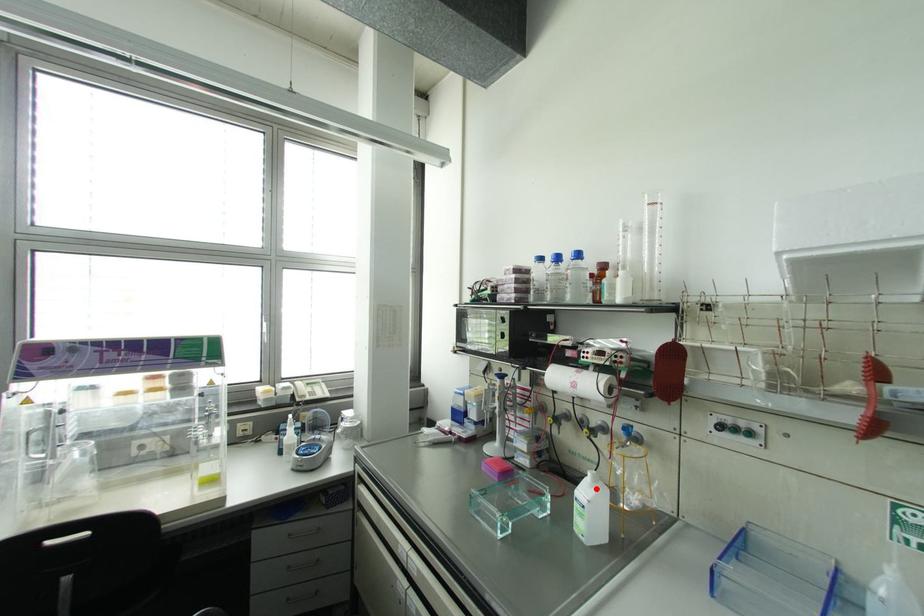
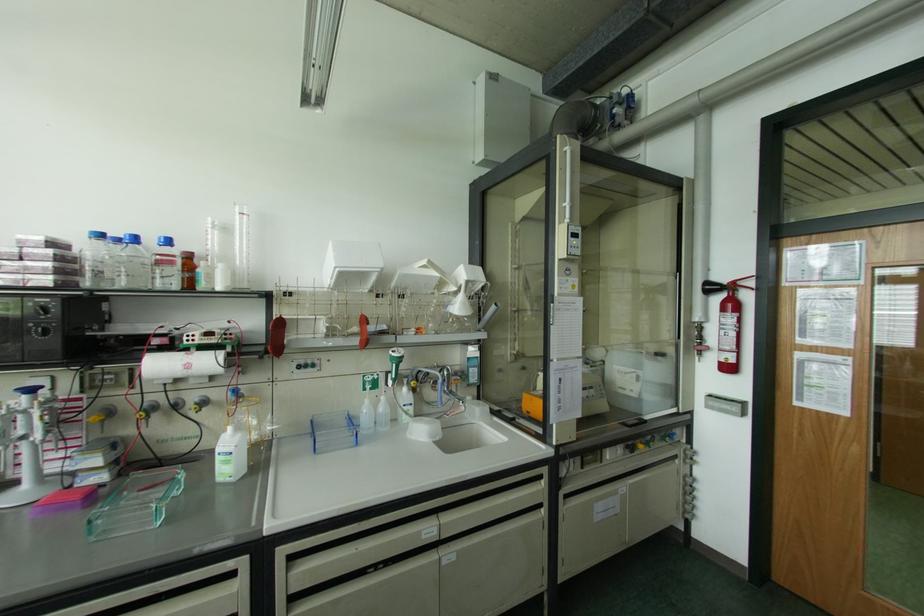
The point at the highlighted location is marked in the first image. Where is the corresponding point in the second image?

(238, 435)